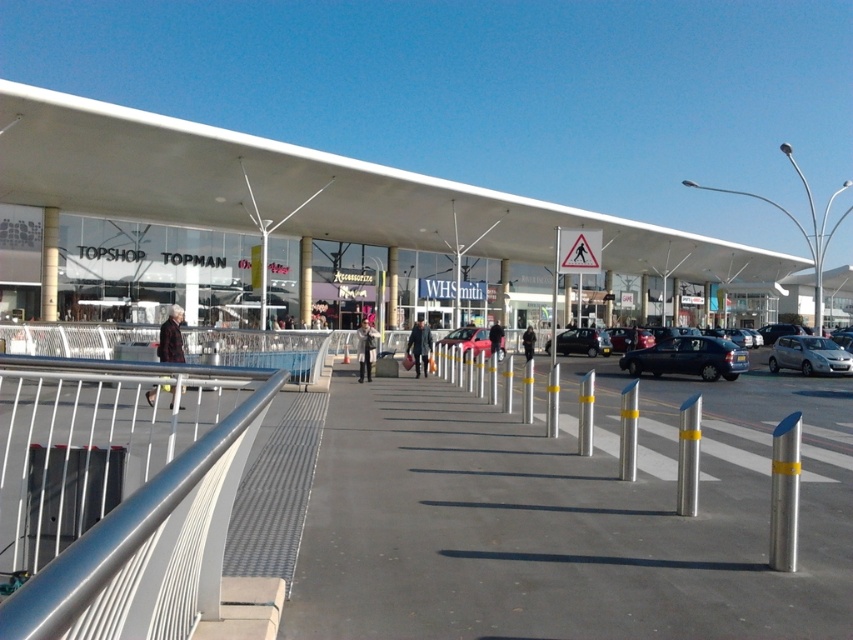
You are a pedestrian standing on the walkway and want to take a shortcut to the entrance of the white glass mall at center. Can you walk directly towards it from your current position, or do you need to go around the silver metallic car at right?

The white glass mall at center is positioned over the silver metallic car at right, meaning the car is directly in the path to the mall entrance. You will need to go around the silver metallic car at right to reach the entrance.

You are a delivery person trying to park your metallic blue sedan at center in the shopping center. The parking spot available is the gray concrete pavement at center. Can your sedan fit into the parking spot?

The gray concrete pavement at center has a width larger than the metallic blue sedan at center, so yes, the sedan can fit into the parking spot.

You are a delivery person needing to move a large carton box through the shopping center. You see a silver metallic rail at lower left and a silver metallic car at right. Which object has a wider width that could potentially block the path?

The silver metallic rail at lower left has a larger width than the silver metallic car at right, so it could potentially block the path more than the car.